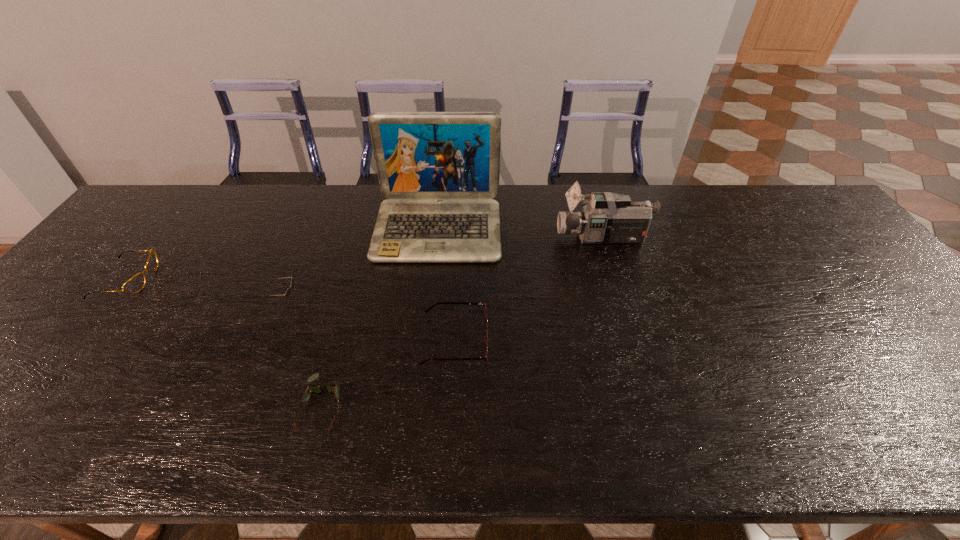
Where is `the tallest object`? The height and width of the screenshot is (540, 960). the tallest object is located at coordinates (439, 170).

This screenshot has width=960, height=540. Identify the location of camcorder. point(607,218).

This screenshot has height=540, width=960. Identify the location of the fifth shortest object. (607, 218).

You are a GUI agent. You are given a task and a screenshot of the screen. Output one action in this format:
    pyautogui.click(x=<x>, y=<y>)
    Task: Click on the sunglasses
    
    Given the screenshot: What is the action you would take?
    (x=288, y=292)

Find the location of a particular element. This screenshot has height=540, width=960. the fifth object from right to left is located at coordinates (288, 292).

Locate an element on the screen. This screenshot has height=540, width=960. the farthest spectacles is located at coordinates (135, 284).

The image size is (960, 540). I want to click on the leftmost spectacles, so click(135, 284).

Locate an element on the screen. The image size is (960, 540). the rightmost spectacles is located at coordinates (485, 357).

The height and width of the screenshot is (540, 960). Find the location of `the shortest object`. the shortest object is located at coordinates point(332,388).

Image resolution: width=960 pixels, height=540 pixels. Identify the location of the nearest spectacles. (332, 388).